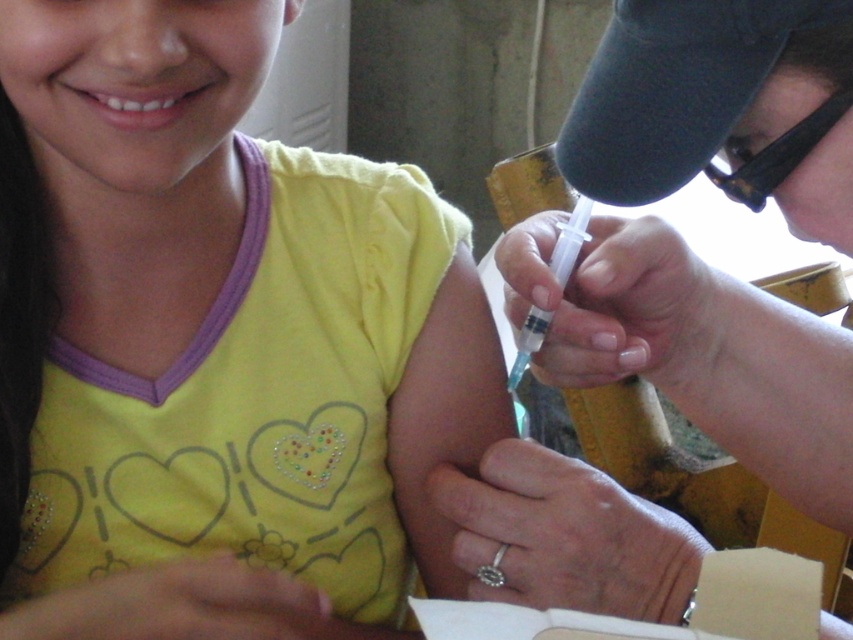
You are a healthcare provider observing the scene. You need to place a medical chart exactly at the same position as the yellow matte shirt at upper center. According to the coordinates provided, where should you place the chart?

The yellow matte shirt at upper center is located at point (216, 342), so you should place the medical chart at those coordinates to match its position.

You are a photographer taking a picture of the yellow matte shirt at upper center and the black plastic goggles at upper right. To ensure both are in focus, you need to adjust your camera settings. Which object is closer to the camera so you can set the focal point accordingly?

The yellow matte shirt at upper center is closer to the camera than the black plastic goggles at upper right because the goggles are positioned behind the shirt.